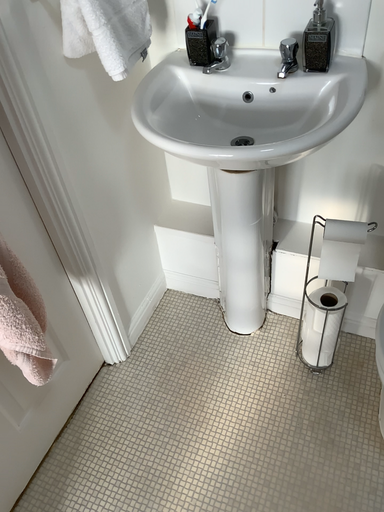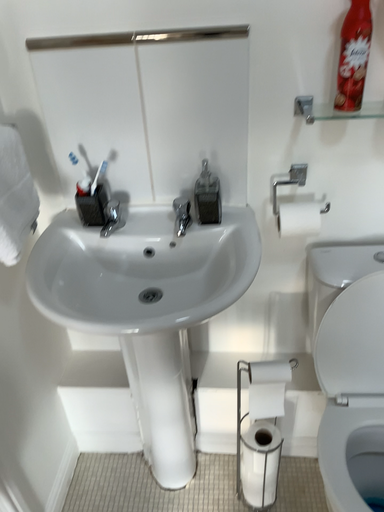
Question: How did the camera likely rotate when shooting the video?

Choices:
 (A) rotated upward
 (B) rotated downward

Answer: (A)